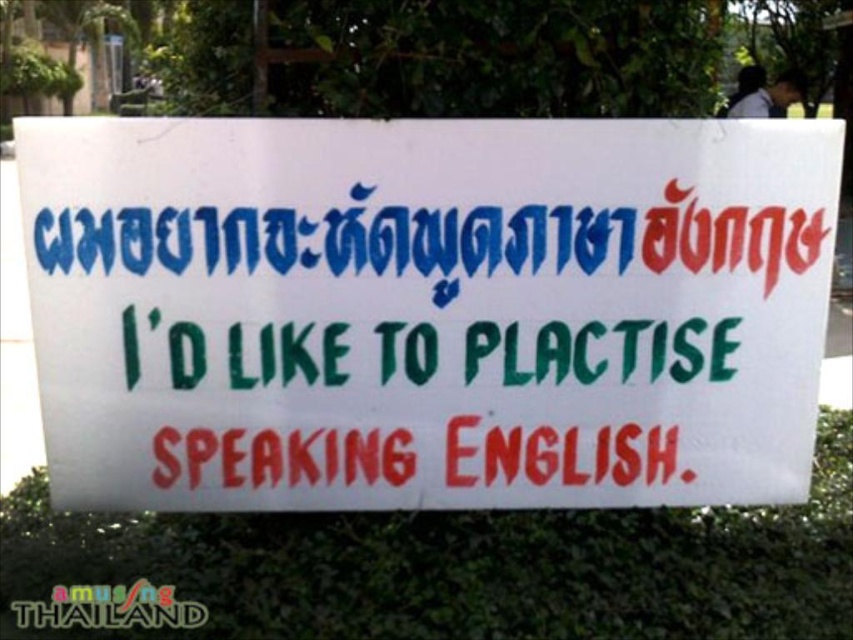
Is point (599, 339) behind point (308, 584)?

That is True.

From the picture: Between white paper sign at center and green leafy hedge at center, which one appears on the right side from the viewer's perspective?

green leafy hedge at center is more to the right.

Identify the location of white paper sign at center. This screenshot has width=853, height=640. (426, 310).

The height and width of the screenshot is (640, 853). Find the location of `white paper sign at center`. white paper sign at center is located at coordinates (426, 310).